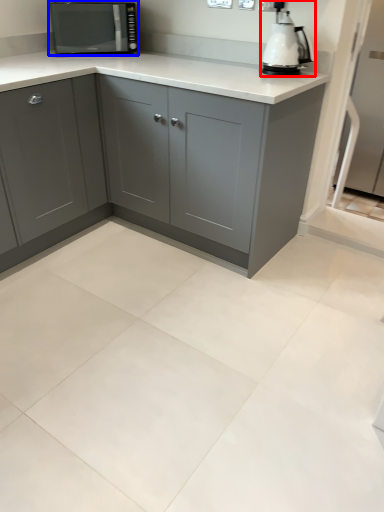
Question: Which of the following is the closest to the observer, home appliance (highlighted by a red box) or kitchen appliance (highlighted by a blue box)?

Choices:
 (A) home appliance
 (B) kitchen appliance

Answer: (A)